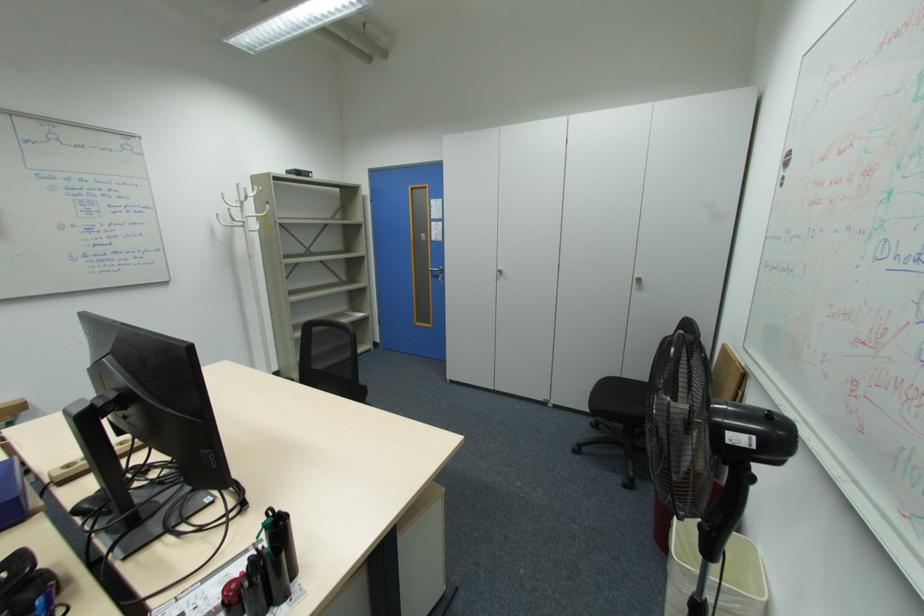
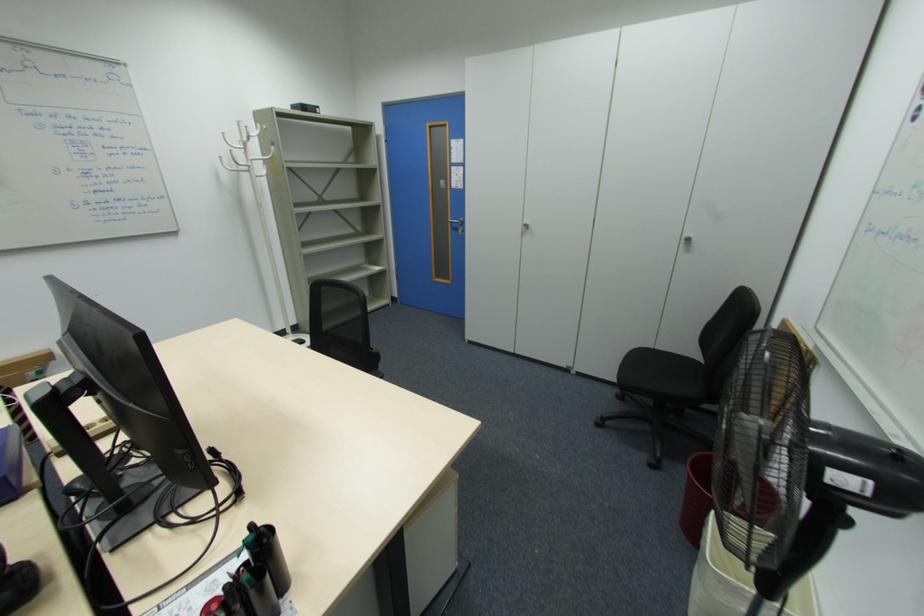
Question: Based on the continuous images, in which direction is the camera rotating? Reply with the corresponding letter.

Choices:
 (A) Left
 (B) Right
 (C) Up
 (D) Down

Answer: (D)